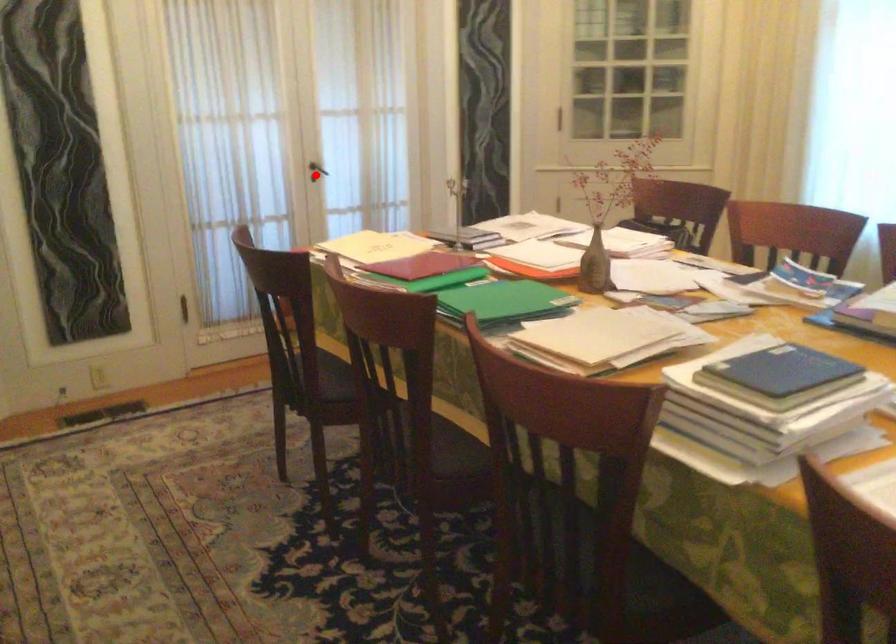
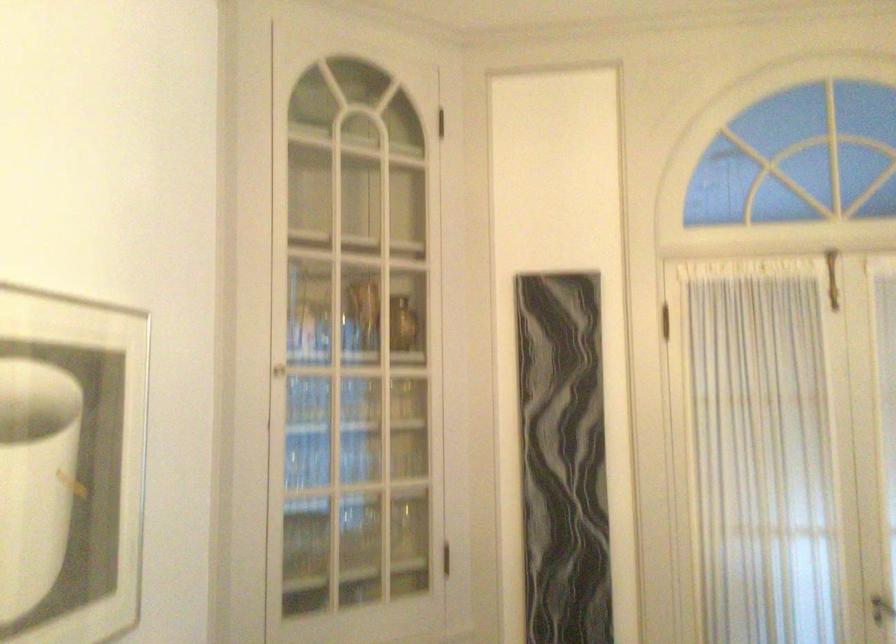
Find the pixel in the second image that matches the highlighted location in the first image.

(882, 609)